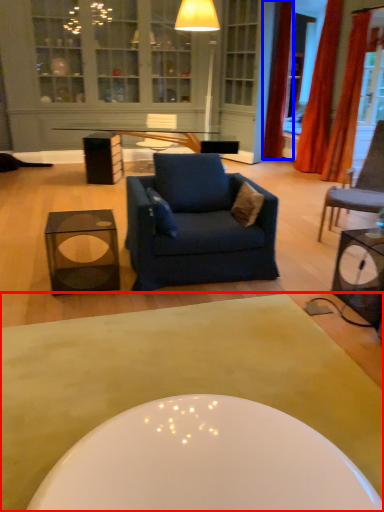
Question: Among these objects, which one is farthest to the camera, coffee table (highlighted by a red box) or curtain (highlighted by a blue box)?

Choices:
 (A) coffee table
 (B) curtain

Answer: (B)